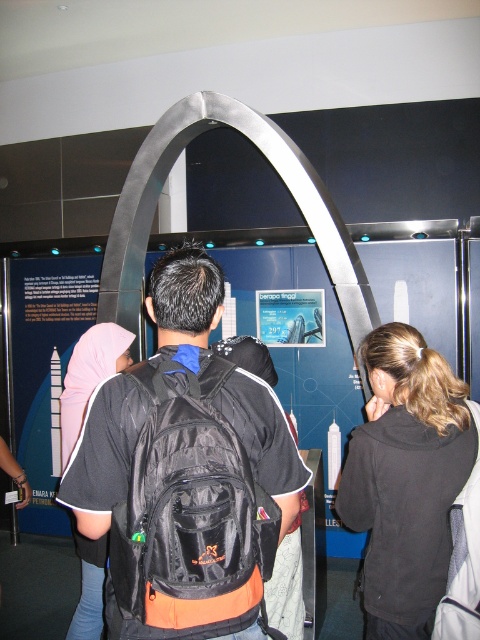
You are a security guard in the museum and need to locate the black fabric backpack at center for a visitor. According to the coordinates provided, where exactly is the backpack positioned in the image?

The black fabric backpack at center is located at point coordinates 0.739 on the x axis and 0.385 on the y axis.

You are a tour guide at the museum and need to direct a visitor to the exit, which is located behind the black fabric jacket at center. The visitor is currently standing near the matte pink hijab at upper left. Can you tell them the direction to go?

The black fabric jacket at center is below the matte pink hijab at upper left, so the visitor should move downward from the matte pink hijab at upper left to reach the exit behind the black fabric jacket at center.